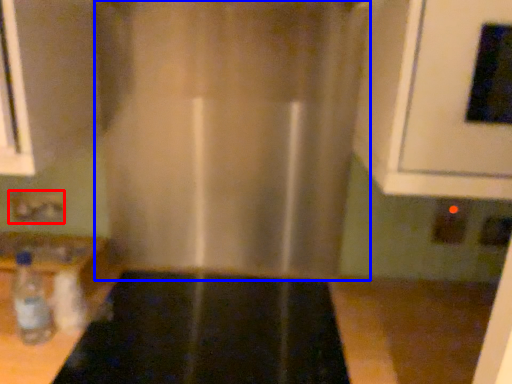
Question: Which of the following is the farthest to the observer, electric outlet (highlighted by a red box) or curtain (highlighted by a blue box)?

Choices:
 (A) electric outlet
 (B) curtain

Answer: (A)